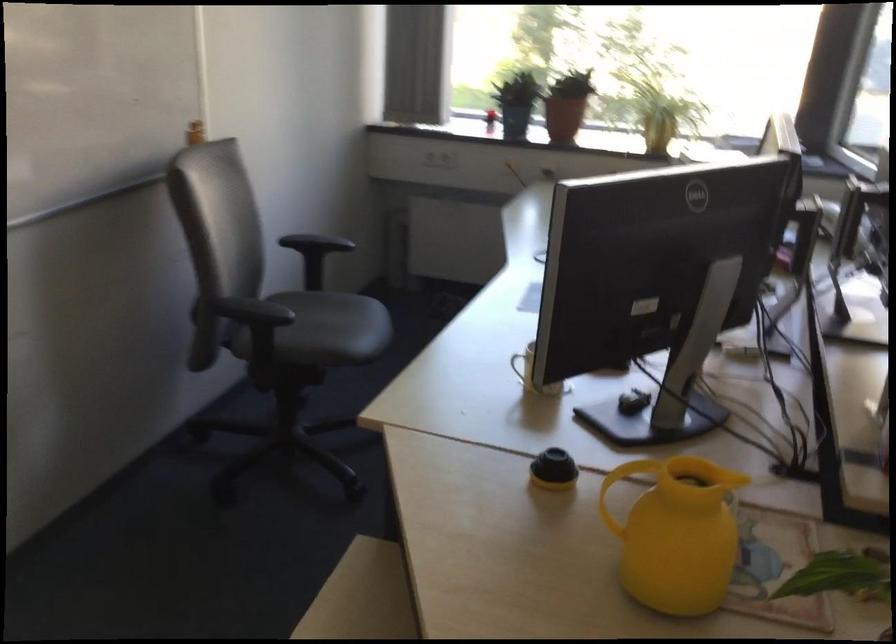
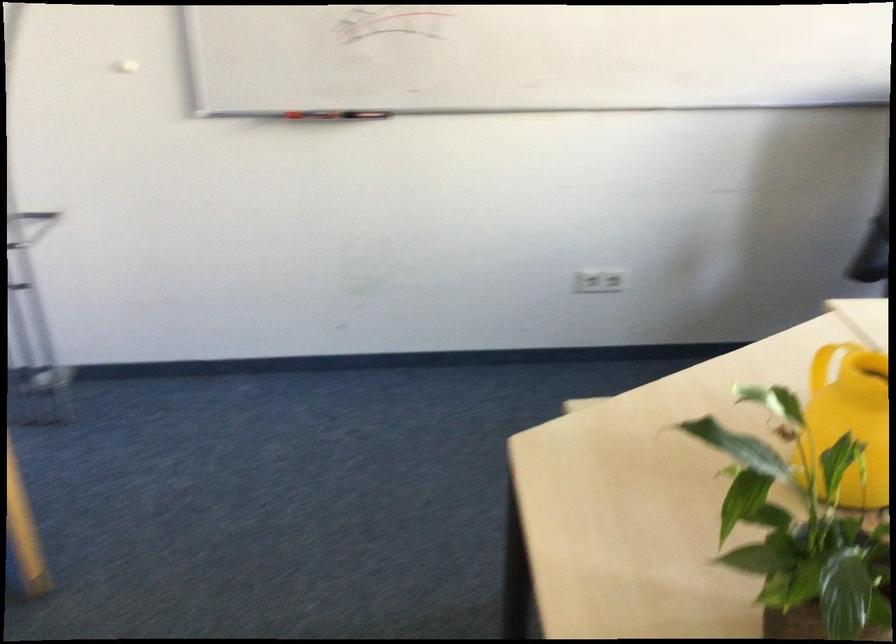
Locate, in the second image, the point that corresponds to pixel 648 529 in the first image.

(849, 420)